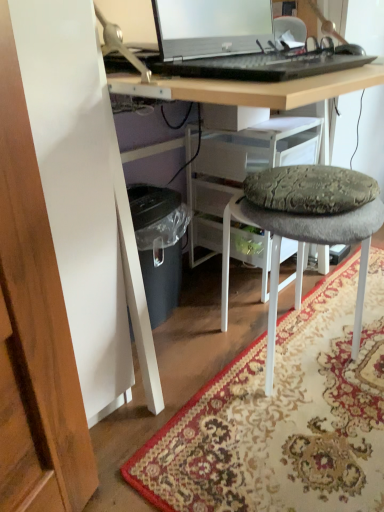
Question: From the image's perspective, is patterned carpet at lower center below sleek silver laptop at upper center?

Choices:
 (A) yes
 (B) no

Answer: (A)

Question: From the image's perspective, is patterned carpet at lower center on top of sleek silver laptop at upper center?

Choices:
 (A) yes
 (B) no

Answer: (B)

Question: Is patterned carpet at lower center positioned behind sleek silver laptop at upper center?

Choices:
 (A) yes
 (B) no

Answer: (A)

Question: Does patterned carpet at lower center appear on the left side of sleek silver laptop at upper center?

Choices:
 (A) yes
 (B) no

Answer: (B)

Question: Is sleek silver laptop at upper center at the back of patterned carpet at lower center?

Choices:
 (A) yes
 (B) no

Answer: (B)

Question: Considering the positions of patterned carpet at lower center and textured gray cushioned stool at center in the image, is patterned carpet at lower center taller or shorter than textured gray cushioned stool at center?

Choices:
 (A) short
 (B) tall

Answer: (A)

Question: From the image's perspective, relative to textured gray cushioned stool at center, is patterned carpet at lower center above or below?

Choices:
 (A) above
 (B) below

Answer: (B)

Question: Relative to textured gray cushioned stool at center, is patterned carpet at lower center in front or behind?

Choices:
 (A) front
 (B) behind

Answer: (A)

Question: In terms of width, does patterned carpet at lower center look wider or thinner when compared to textured gray cushioned stool at center?

Choices:
 (A) thin
 (B) wide

Answer: (B)

Question: From a real-world perspective, is sleek silver laptop at upper center positioned above or below textured gray cushioned stool at center?

Choices:
 (A) below
 (B) above

Answer: (B)

Question: From their relative heights in the image, would you say sleek silver laptop at upper center is taller or shorter than textured gray cushioned stool at center?

Choices:
 (A) tall
 (B) short

Answer: (B)

Question: From the image's perspective, is sleek silver laptop at upper center above or below textured gray cushioned stool at center?

Choices:
 (A) above
 (B) below

Answer: (A)

Question: Looking at the image, does sleek silver laptop at upper center seem bigger or smaller compared to textured gray cushioned stool at center?

Choices:
 (A) big
 (B) small

Answer: (B)

Question: Looking at the image, does textured gray cushioned stool at center seem bigger or smaller compared to patterned carpet at lower center?

Choices:
 (A) small
 (B) big

Answer: (B)

Question: Is textured gray cushioned stool at center to the left or to the right of patterned carpet at lower center in the image?

Choices:
 (A) left
 (B) right

Answer: (A)